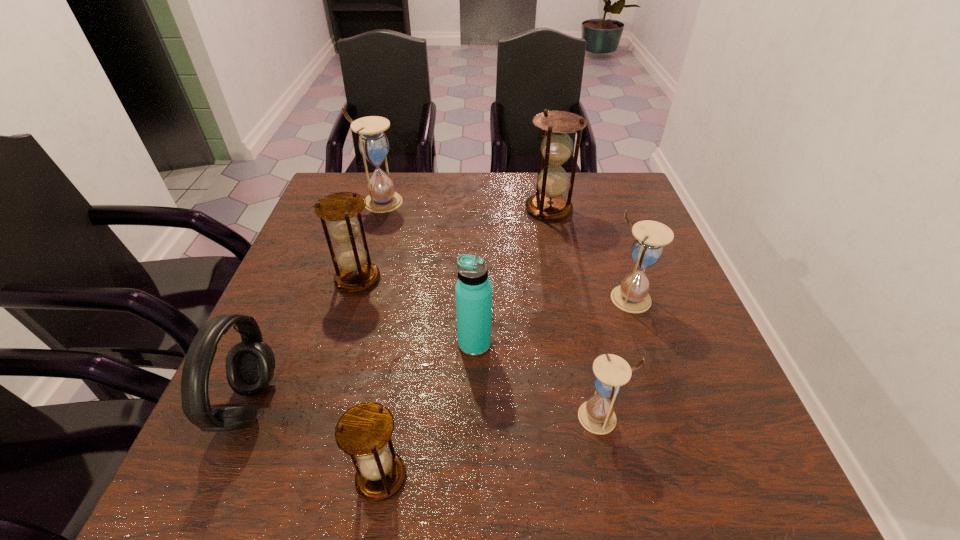
Locate an element on the screen. The image size is (960, 540). gray headset is located at coordinates (250, 364).

The width and height of the screenshot is (960, 540). In order to click on the leftmost object in this screenshot , I will do [250, 364].

Find the location of a particular element. The height and width of the screenshot is (540, 960). the second white hourglass from right to left is located at coordinates (597, 415).

Find the location of a particular element. the nearest white hourglass is located at coordinates (597, 415).

This screenshot has height=540, width=960. Find the location of `the fifth object from right to left`. the fifth object from right to left is located at coordinates (363, 431).

Where is `the smallest brown hourglass`? the smallest brown hourglass is located at coordinates (363, 431).

Where is `vacant space located 0.120m on the right of the farthest white hourglass`? The width and height of the screenshot is (960, 540). vacant space located 0.120m on the right of the farthest white hourglass is located at coordinates (444, 202).

Locate an element on the screen. The image size is (960, 540). vacant space located 0.140m on the right of the biggest brown hourglass is located at coordinates (621, 208).

Where is `free space located on the right of the fourth nearest object`? free space located on the right of the fourth nearest object is located at coordinates (622, 344).

Locate an element on the screen. free space located 0.070m on the right of the second farthest brown hourglass is located at coordinates (410, 279).